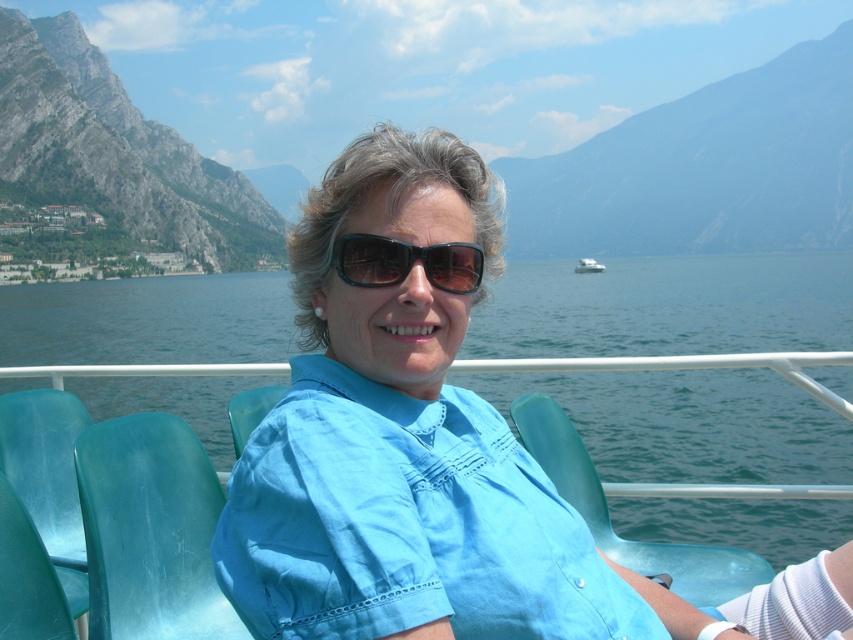
You are a photographer planning to capture a landscape photo that includes both the rugged stone mountain at left and the white glossy boat at center. Based on their positions, which object should you position closer to the left edge of your camera frame?

The rugged stone mountain at left should be positioned closer to the left edge of the camera frame since it is located to the left of the white glossy boat at center.

You are a photographer trying to capture the rugged stone mountain at left and the black plastic sunglasses at center in a single frame. Which object should you focus on first to ensure both are in the frame without moving the camera?

You should focus on the rugged stone mountain at left first because it is larger in size than the black plastic sunglasses at center, so it will take up more space in the frame and require proper framing before adjusting for the smaller object.